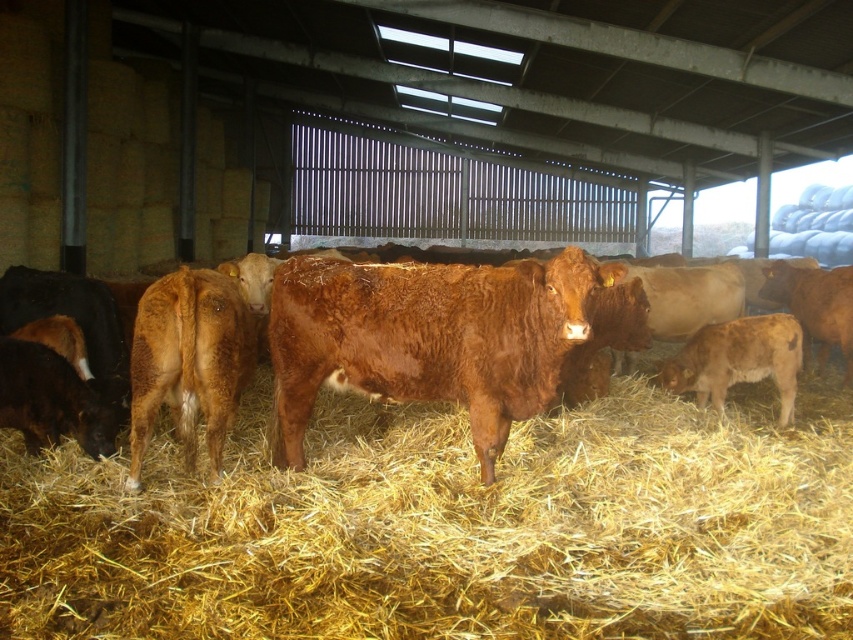
Which of these two, brown furry bull at center or brown furry calf at lower right, stands taller?

brown furry bull at center is taller.

This screenshot has width=853, height=640. In order to click on brown furry bull at center in this screenshot , I will do (x=428, y=339).

What do you see at coordinates (428, 339) in the screenshot? The image size is (853, 640). I see `brown furry bull at center` at bounding box center [428, 339].

The height and width of the screenshot is (640, 853). What are the coordinates of `brown furry bull at center` in the screenshot? It's located at (428, 339).

Can you confirm if yellow straw at center is positioned above brown furry calf at lower right?

Actually, yellow straw at center is below brown furry calf at lower right.

Does point (229, 502) lie behind point (676, 364)?

No, it is not.

Between point (642, 602) and point (692, 358), which one is positioned behind?

Positioned behind is point (692, 358).

Where is `yellow straw at center`? yellow straw at center is located at coordinates (450, 528).

Can you confirm if brown furry cow at center is positioned above brown furry bull at center?

Yes, brown furry cow at center is above brown furry bull at center.

Between brown furry cow at center and brown furry bull at center, which one appears on the left side from the viewer's perspective?

brown furry cow at center

This screenshot has width=853, height=640. What do you see at coordinates (427, 340) in the screenshot?
I see `brown furry cow at center` at bounding box center [427, 340].

Find the location of a particular element. This screenshot has height=640, width=853. brown furry cow at center is located at coordinates click(x=427, y=340).